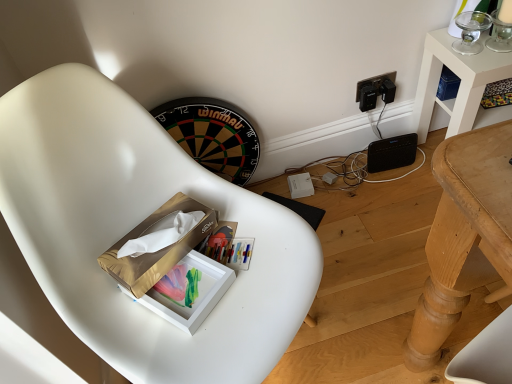
Question: Relative to matte gold tissue box at center, is gold cardboard box at center in front or behind?

Choices:
 (A) behind
 (B) front

Answer: (B)

Question: Looking at the image, does gold cardboard box at center seem bigger or smaller compared to matte gold tissue box at center?

Choices:
 (A) big
 (B) small

Answer: (A)

Question: Which object is the farthest from the matte gold tissue box at center?

Choices:
 (A) white matte chair at center
 (B) gold cardboard box at center

Answer: (A)

Question: Based on their relative distances, which object is nearer to the white matte chair at center?

Choices:
 (A) gold cardboard box at center
 (B) matte gold tissue box at center

Answer: (A)